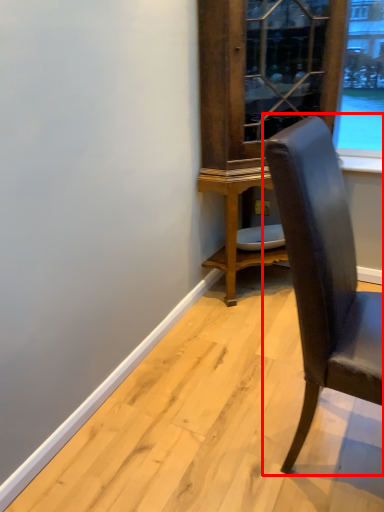
Question: Observing the image, what is the correct spatial positioning of chair (annotated by the red box) in reference to dresser?

Choices:
 (A) right
 (B) left

Answer: (A)